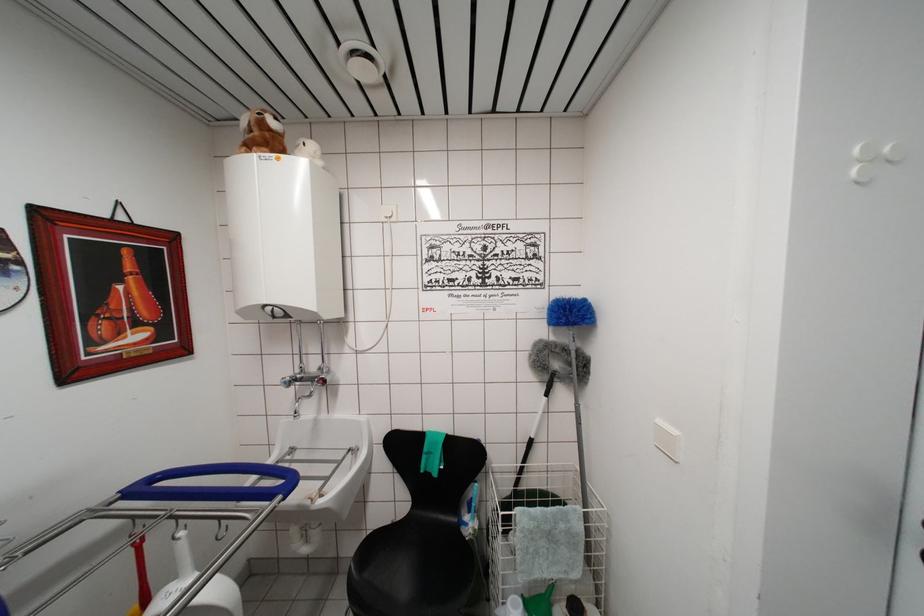
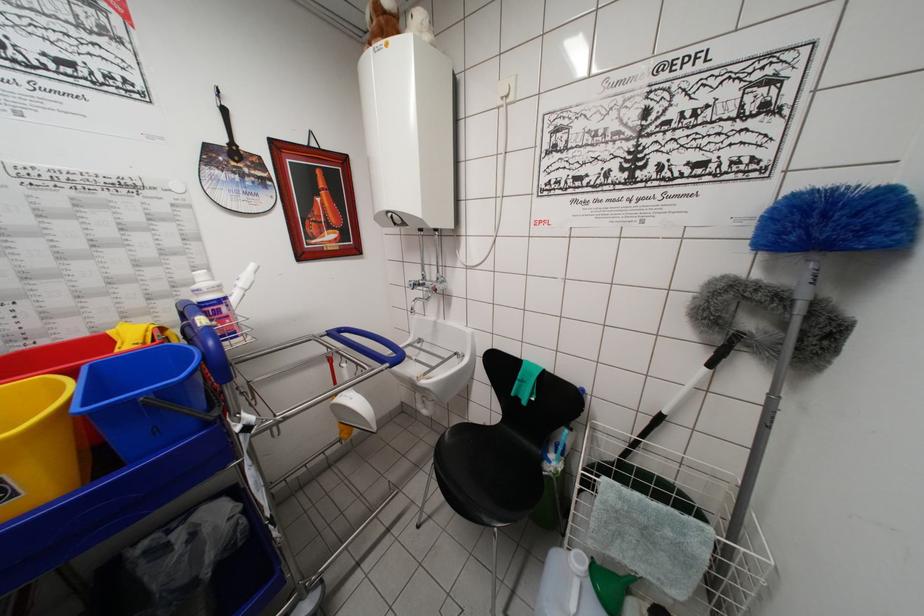
Find the pixel in the second image that matches point (570, 310) in the first image.

(821, 209)